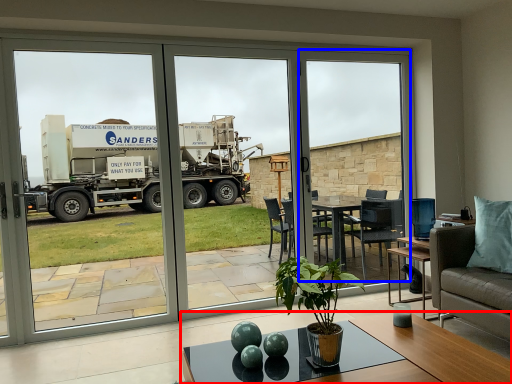
Question: Which point is closer to the camera, coffee table (highlighted by a red box) or window screen (highlighted by a blue box)?

Choices:
 (A) coffee table
 (B) window screen

Answer: (A)